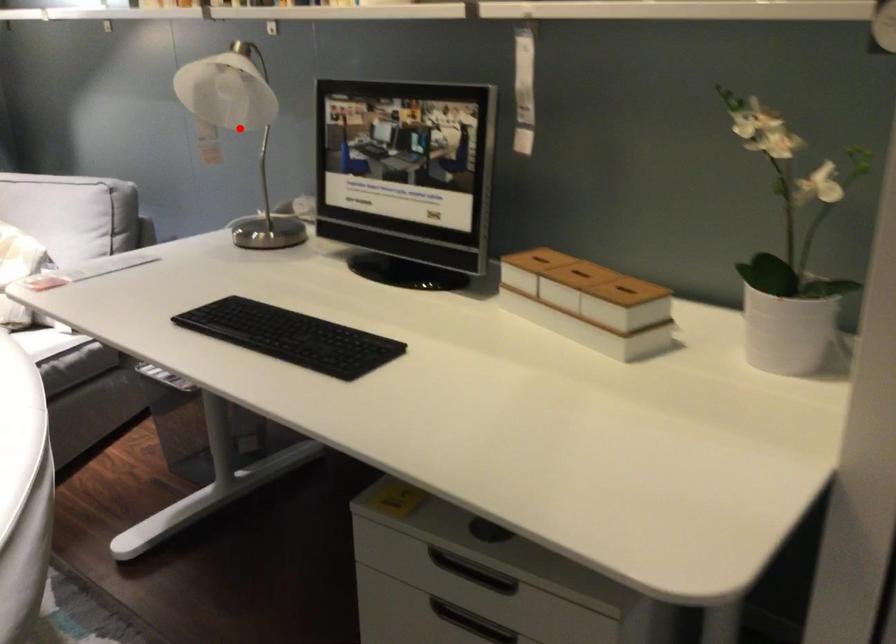
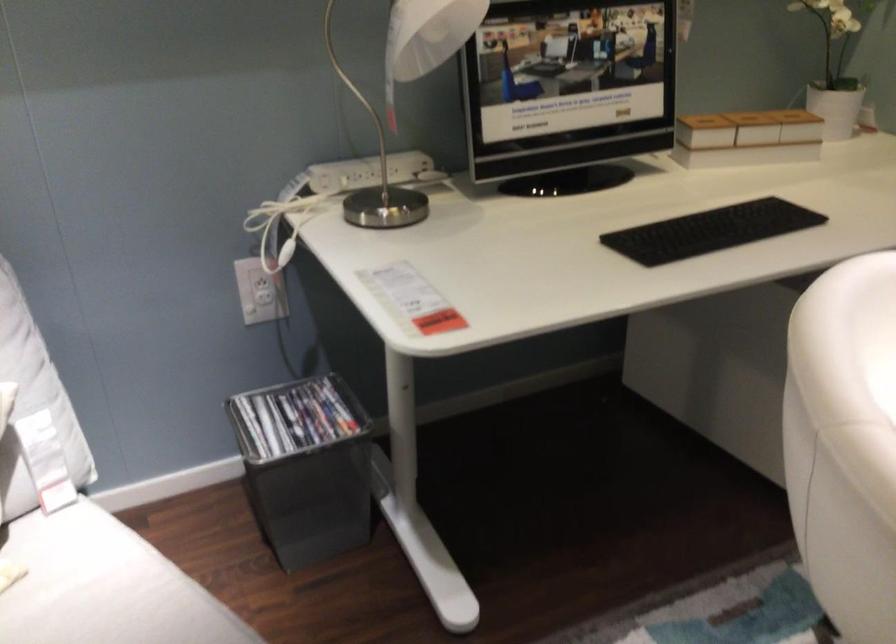
Question: I am providing you with two images of the same scene from different viewpoints. A red point is marked on the first image. Can you still see the location of the red point in image 2?

Choices:
 (A) Yes
 (B) No

Answer: (B)